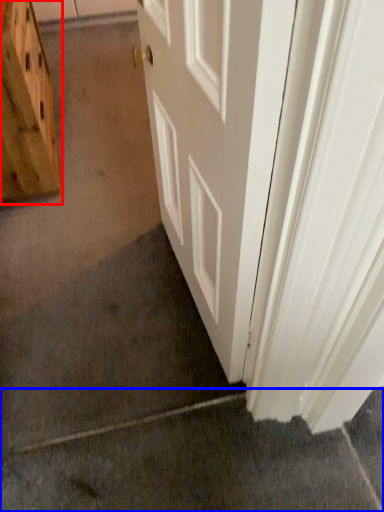
Question: Among these objects, which one is nearest to the camera, cabinetry (highlighted by a red box) or concrete (highlighted by a blue box)?

Choices:
 (A) cabinetry
 (B) concrete

Answer: (B)